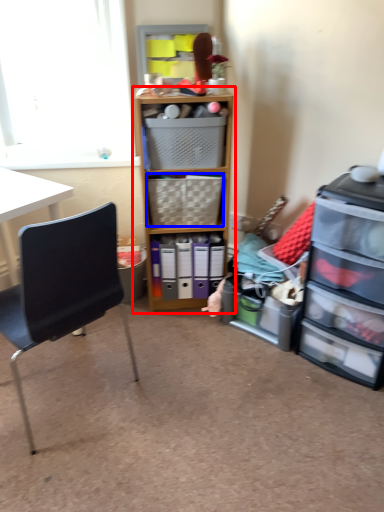
Question: Which of the following is the closest to the observer, cabinetry (highlighted by a red box) or picnic basket (highlighted by a blue box)?

Choices:
 (A) cabinetry
 (B) picnic basket

Answer: (A)